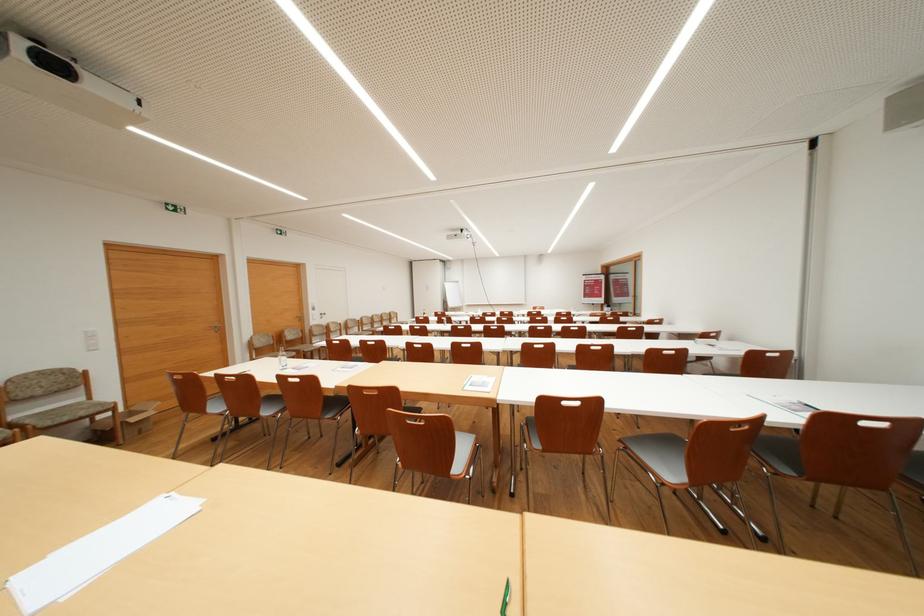
The height and width of the screenshot is (616, 924). Describe the element at coordinates (91, 339) in the screenshot. I see `the white light switch` at that location.